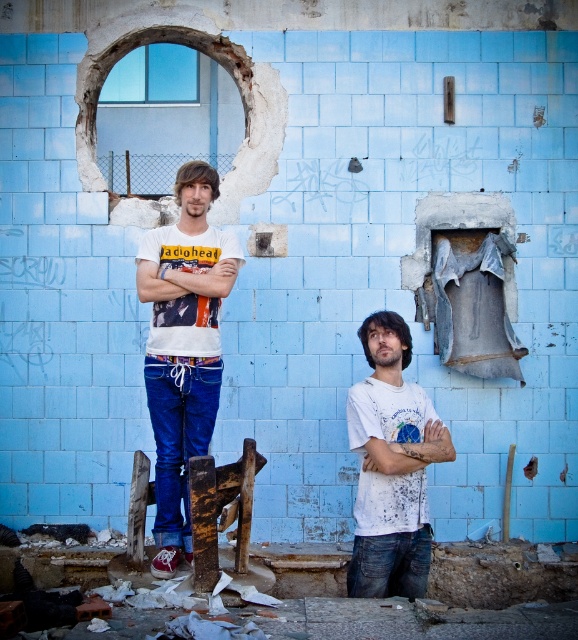
Question: Does white cotton t-shirt at center have a greater width compared to white matte t-shirt at center?

Choices:
 (A) yes
 (B) no

Answer: (A)

Question: Which of the following is the farthest from the observer?

Choices:
 (A) (190, 241)
 (B) (379, 317)

Answer: (B)

Question: Which point is farther to the camera?

Choices:
 (A) (191, 192)
 (B) (424, 538)

Answer: (A)

Question: Which point is farther to the camera?

Choices:
 (A) white matte t-shirt at center
 (B) white cotton t-shirt at center

Answer: (B)

Question: Can you confirm if white cotton t-shirt at center is wider than white matte t-shirt at center?

Choices:
 (A) no
 (B) yes

Answer: (B)

Question: Does white cotton t-shirt at center appear under white matte t-shirt at center?

Choices:
 (A) yes
 (B) no

Answer: (B)